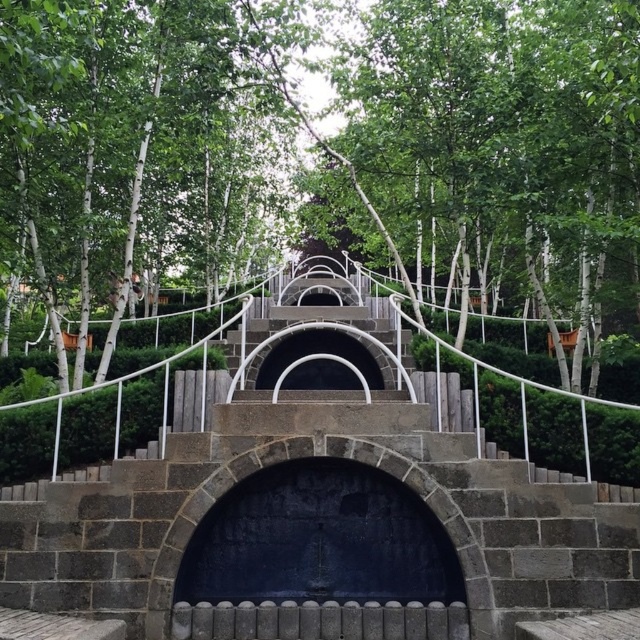
Question: Can you confirm if dark stone archway at center is positioned below black stone arch at center?

Choices:
 (A) yes
 (B) no

Answer: (A)

Question: Considering the real-world distances, which object is closest to the green leafy tree at center?

Choices:
 (A) dark stone archway at center
 (B) black stone arch at center
 (C) dark gray stone stairs at center

Answer: (B)

Question: Based on their relative distances, which object is nearer to the black stone arch at center?

Choices:
 (A) green leafy tree at center
 (B) dark gray stone stairs at center
 (C) dark stone archway at center

Answer: (B)

Question: Does green leafy tree at center have a greater width compared to black stone arch at center?

Choices:
 (A) yes
 (B) no

Answer: (B)

Question: Can you confirm if green leafy tree at center is thinner than dark stone archway at center?

Choices:
 (A) yes
 (B) no

Answer: (A)

Question: Among these objects, which one is farthest from the camera?

Choices:
 (A) black stone arch at center
 (B) dark gray stone stairs at center
 (C) green leafy tree at center
 (D) dark stone archway at center

Answer: (C)